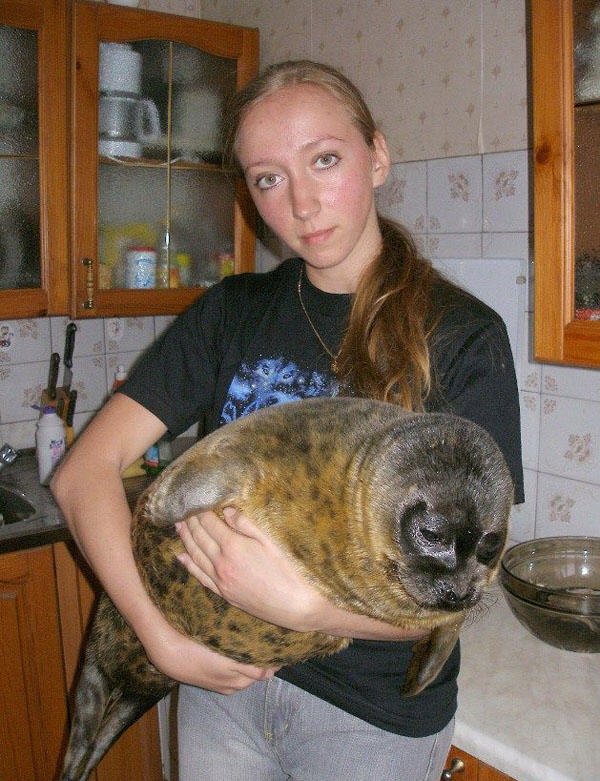
This screenshot has width=600, height=781. I want to click on cabinet, so click(x=104, y=307), click(x=51, y=305).